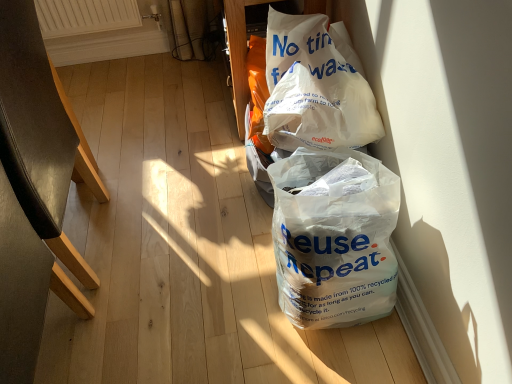
Question: Is white plastic bag at lower right, the second plastic bag in the top-to-bottom sequence, in front of or behind white textured radiator at upper left in the image?

Choices:
 (A) front
 (B) behind

Answer: (A)

Question: Considering the positions of white plastic bag at lower right, arranged as the first plastic bag when ordered from the bottom, and white textured radiator at upper left in the image, is white plastic bag at lower right, arranged as the first plastic bag when ordered from the bottom, wider or thinner than white textured radiator at upper left?

Choices:
 (A) wide
 (B) thin

Answer: (A)

Question: Which of these objects is positioned farthest from the white paper bag at upper right, acting as the second plastic bag starting from the bottom?

Choices:
 (A) black leather chair at left
 (B) white textured radiator at upper left
 (C) white plastic bag at lower right, arranged as the first plastic bag when ordered from the bottom

Answer: (B)

Question: Which object is the closest to the white paper bag at upper right, the 1th plastic bag in the top-to-bottom sequence?

Choices:
 (A) white plastic bag at lower right, arranged as the first plastic bag when ordered from the bottom
 (B) black leather chair at left
 (C) white textured radiator at upper left

Answer: (A)